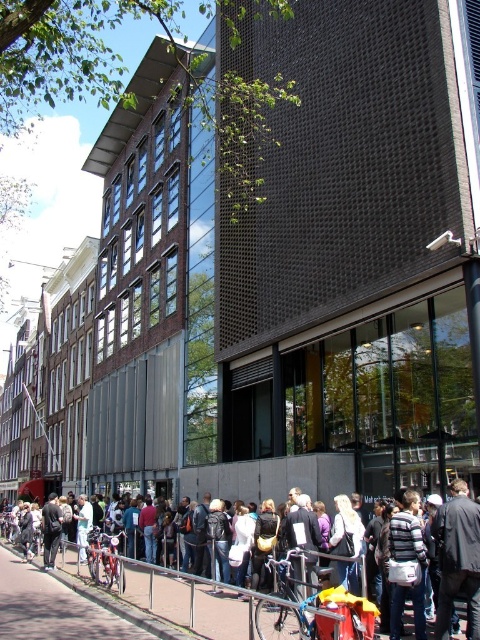
Question: Where is white cotton shirt at center located in relation to concrete pavement at lower center in the image?

Choices:
 (A) below
 (B) above

Answer: (B)

Question: Which of the following is the closest to the observer?

Choices:
 (A) white cotton shirt at center
 (B) concrete pavement at lower center

Answer: (A)

Question: Is white cotton shirt at center positioned before concrete pavement at lower center?

Choices:
 (A) yes
 (B) no

Answer: (A)

Question: Which of the following is the farthest from the observer?

Choices:
 (A) (300, 618)
 (B) (108, 593)

Answer: (B)

Question: Does white cotton shirt at center appear on the right side of concrete pavement at lower center?

Choices:
 (A) no
 (B) yes

Answer: (B)